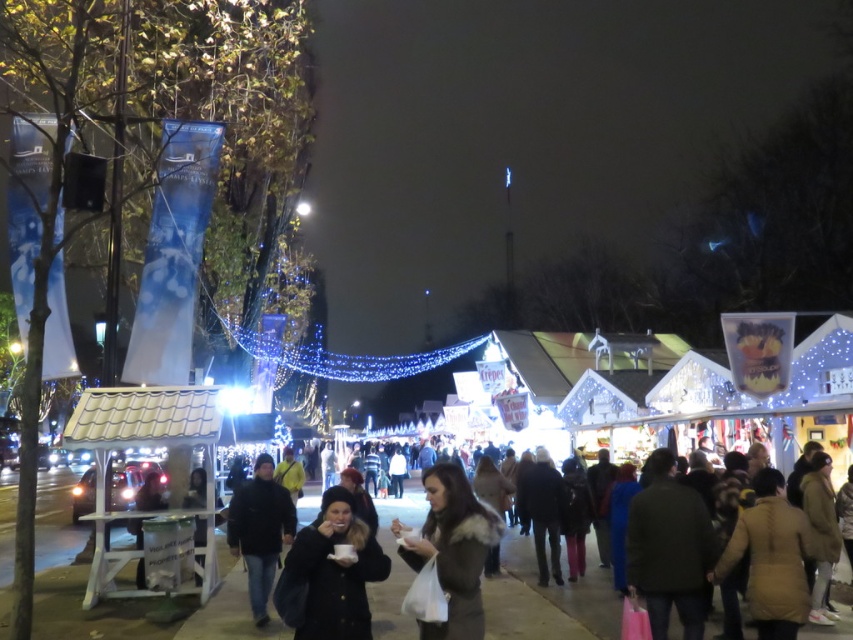
You are standing at the entrance of the market and want to reach a specific point in the crowd. The point is located at coordinates point (x=463, y=600). If you can walk 1.2 meters per second, how long will it take you to reach that point?

The distance of point (x=463, y=600) from viewer is 61.97 meters. At a walking speed of 1.2 meters per second, it will take approximately 51.64 seconds to reach the point.

You are at the market and want to buy a drink from the stall behind the dark blue jacket at center. Can you easily access the stall because the black fuzzy hat at center is in front of it?

The black fuzzy hat at center is in front of the dark blue jacket at center, so you might have difficulty accessing the stall behind the dark blue jacket at center because the black fuzzy hat at center is blocking the path.

You are at the market and want to find a spot to sit down. You see a bench that is 1.5 meters tall. Can you sit on it comfortably if you are wearing the black fuzzy hat at center and the dark blue jacket at center?

The black fuzzy hat at center is shorter than the dark blue jacket at center. However, the height of the bench is 1.5 meters, which is quite tall for a typical bench. Comfortably sitting would depend on the individual height and the bench height, but the clothing items do not affect the bench height. The bench might be too high for comfortable sitting regardless of the clothing.